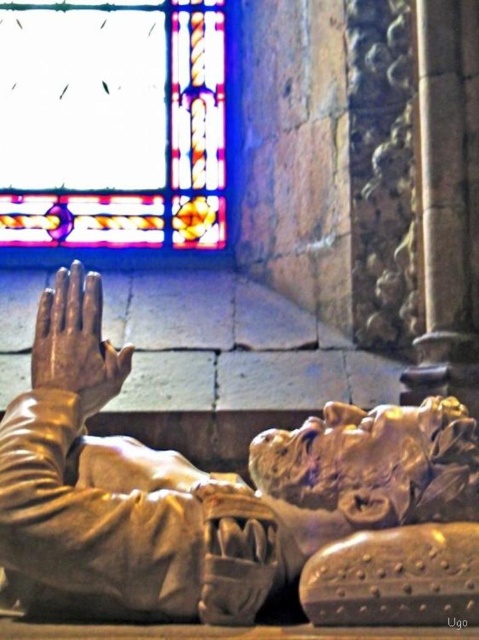
Is gold polished statue at center behind gold metallic hand at center?

No, gold polished statue at center is in front of gold metallic hand at center.

Is point (44, 461) positioned after point (102, 390)?

No, (44, 461) is closer to viewer.

Is point (216, 477) positioned before point (79, 312)?

No.

Locate an element on the screen. This screenshot has height=640, width=479. gold polished statue at center is located at coordinates (197, 488).

Is point (228, 216) more distant than point (91, 397)?

Yes.

Does stained glass window at upper left appear under gold metallic hand at center?

Actually, stained glass window at upper left is above gold metallic hand at center.

Does point (221, 8) come farther from viewer compared to point (95, 289)?

Yes, point (221, 8) is behind point (95, 289).

Locate an element on the screen. stained glass window at upper left is located at coordinates pyautogui.click(x=117, y=129).

Image resolution: width=479 pixels, height=640 pixels. Describe the element at coordinates (197, 488) in the screenshot. I see `gold polished statue at center` at that location.

Does gold polished statue at center lie in front of stained glass window at upper left?

Yes, it is in front of stained glass window at upper left.

Who is more distant from viewer, [337,568] or [66,205]?

Positioned behind is point [66,205].

I want to click on gold polished statue at center, so click(x=197, y=488).